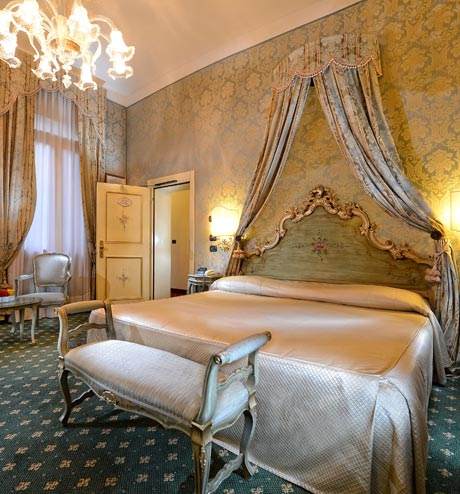
The image size is (460, 494). I want to click on 1 door, so click(x=122, y=250).